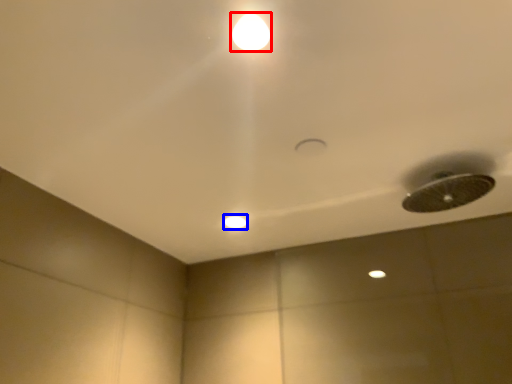
Question: Among these objects, which one is nearest to the camera, lamp (highlighted by a red box) or dot (highlighted by a blue box)?

Choices:
 (A) lamp
 (B) dot

Answer: (A)